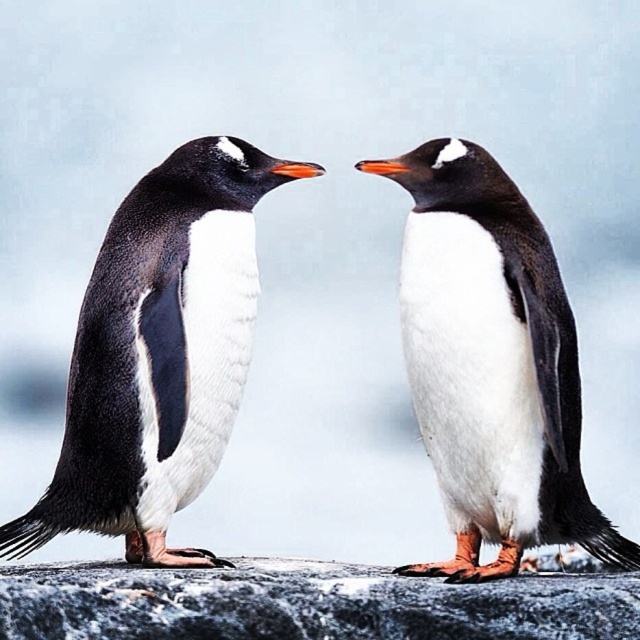
You are a wildlife photographer trying to capture a closeup shot of the white matte penguin at center. You notice the gray rough stone at center is blocking your view. Can you determine if the penguin can move sideways to avoid the stone without overlapping it?

The white matte penguin at center has a lesser width compared to gray rough stone at center. Since the penguin is narrower than the stone, it can move sideways to avoid the stone without overlapping it.